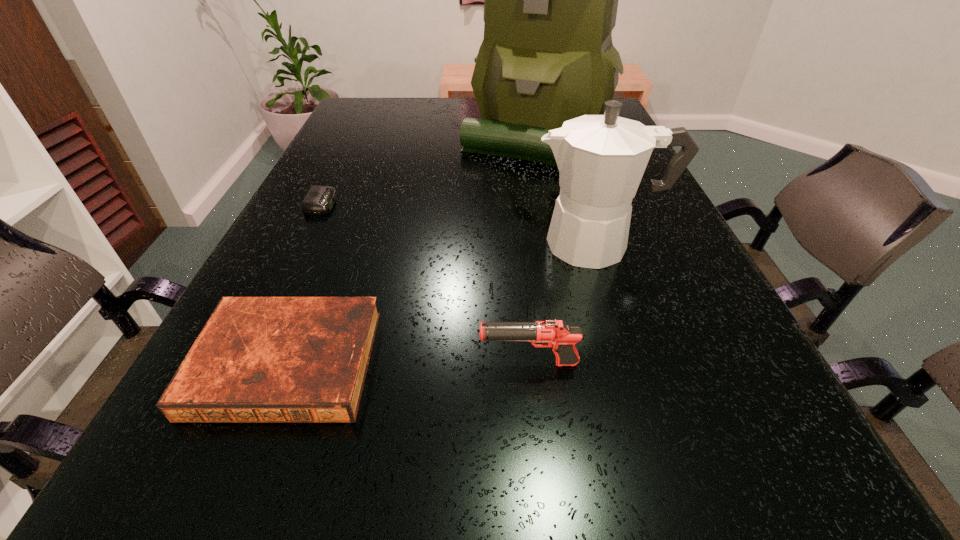
Where is `the tallest object`? the tallest object is located at coordinates (550, 0).

Where is `the farthest object`? the farthest object is located at coordinates (550, 0).

This screenshot has height=540, width=960. Identify the location of the third farthest object. (601, 159).

This screenshot has height=540, width=960. I want to click on coffeepot, so click(601, 159).

Locate an element on the screen. gun is located at coordinates (557, 334).

Image resolution: width=960 pixels, height=540 pixels. I want to click on Bible, so click(x=258, y=359).

Identify the location of alarm clock. This screenshot has height=540, width=960. (319, 200).

Identify the location of the fourth nearest object. click(x=319, y=200).

Identify the location of vacant space located on the front of the farthest object with visible pockets. (544, 192).

What are the coordinates of `free region located at the spout of the third farthest object` in the screenshot? It's located at (460, 244).